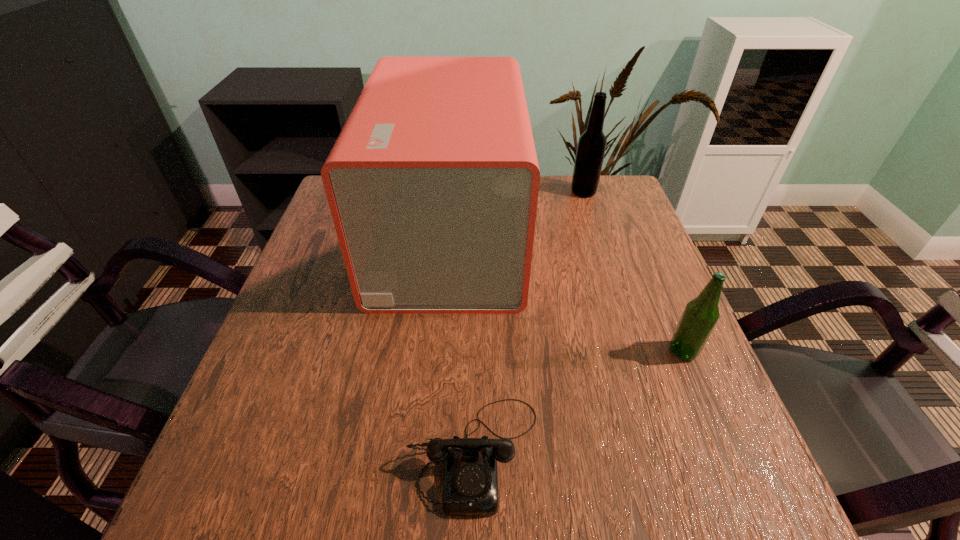
Locate an element on the screen. This screenshot has width=960, height=540. box is located at coordinates (433, 182).

Where is `the second tallest object`? The height and width of the screenshot is (540, 960). the second tallest object is located at coordinates (591, 147).

What are the coordinates of `the farther beer bottle` in the screenshot? It's located at (591, 147).

Image resolution: width=960 pixels, height=540 pixels. Identify the location of the nearer beer bottle. (701, 314).

Where is `the second nearest object`? This screenshot has height=540, width=960. the second nearest object is located at coordinates (701, 314).

Locate an element on the screen. the nearest object is located at coordinates (470, 488).

Image resolution: width=960 pixels, height=540 pixels. In order to click on the shortest object in this screenshot , I will do `click(470, 488)`.

The image size is (960, 540). What are the coordinates of `vacant area located 0.090m on the surface of the tallest object where the text is embossed` in the screenshot? It's located at (557, 237).

The height and width of the screenshot is (540, 960). Identify the location of vacant area located 0.280m on the left of the taller beer bottle. (474, 192).

Find the location of `vacant space situated 0.390m on the label of the nearer beer bottle`. vacant space situated 0.390m on the label of the nearer beer bottle is located at coordinates (470, 351).